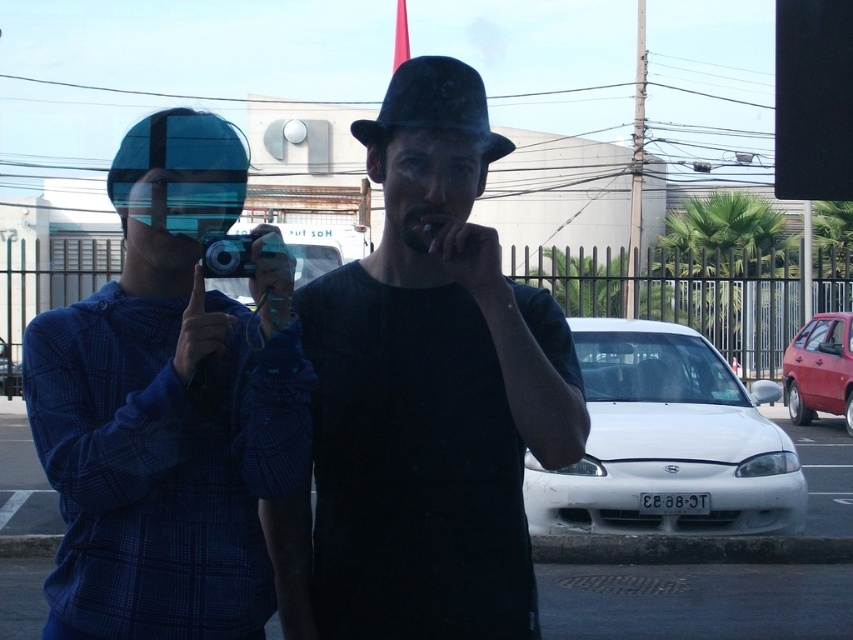
You are a photographer trying to capture a clear shot of the white glossy car at center. The black matte hat at center is blocking your view. Can you move the hat to the right side of the car to get a better angle?

The black matte hat at center is positioned on the left side of white glossy car at center. To move it to the right side, you would need to adjust its position from the current left side location.

You are a photographer trying to fit both the black matte hat at center and the blue plaid sweater at left into a frame. Which object will require more horizontal space in the frame?

The blue plaid sweater at left requires more horizontal space in the frame because its width is greater than the black matte hat at center.

What are the coordinates of the black matte hat at center?

The black matte hat at center is located at point [431,388].